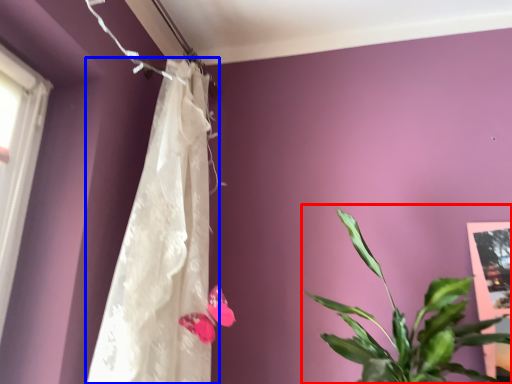
Question: Which object appears farthest to the camera in this image, houseplant (highlighted by a red box) or curtain (highlighted by a blue box)?

Choices:
 (A) houseplant
 (B) curtain

Answer: (B)